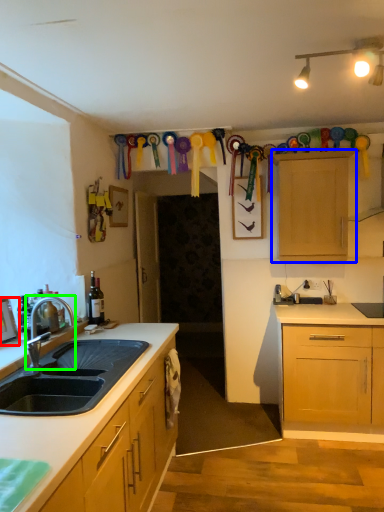
Question: Which is farther away from picture frame (highlighted by a red box)? cabinetry (highlighted by a blue box) or tap (highlighted by a green box)?

Choices:
 (A) cabinetry
 (B) tap

Answer: (A)